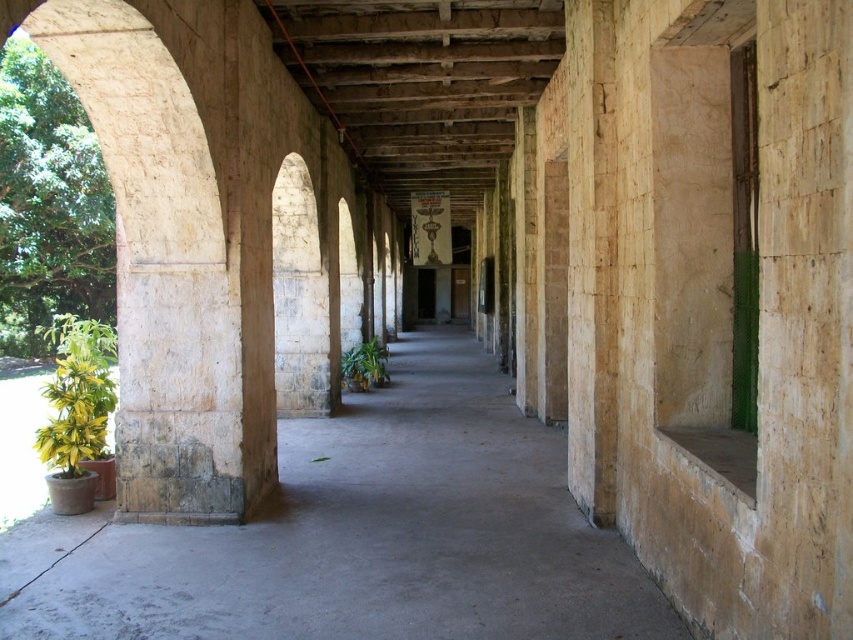
The image size is (853, 640). I want to click on smooth concrete floor at center, so click(358, 536).

Which of these two, smooth concrete floor at center or green leafy plant at left, stands shorter?

Standing shorter between the two is smooth concrete floor at center.

Who is more distant from viewer, (x=463, y=545) or (x=51, y=440)?

The point (x=51, y=440) is more distant.

In order to click on smooth concrete floor at center in this screenshot , I will do `click(358, 536)`.

Consider the image. Is smooth concrete floor at center in front of green matte plant at center?

That is True.

Between smooth concrete floor at center and green matte plant at center, which one has less height?

Standing shorter between the two is smooth concrete floor at center.

Identify the location of smooth concrete floor at center. This screenshot has height=640, width=853. (358, 536).

Who is lower down, green leafy plant at left or green matte plant at center?

green matte plant at center is below.

Does green leafy plant at left have a lesser width compared to green matte plant at center?

In fact, green leafy plant at left might be wider than green matte plant at center.

Where is `green leafy plant at left`? green leafy plant at left is located at coordinates (77, 396).

Find the location of a particular element. This screenshot has width=853, height=640. green leafy plant at left is located at coordinates (77, 396).